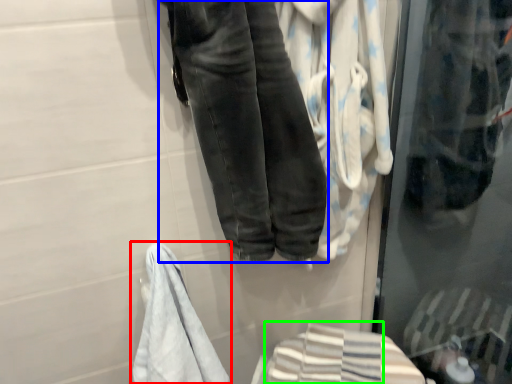
Question: Based on their relative distances, which object is nearer to towel (highlighted by a red box)? Choose from trousers (highlighted by a blue box) and bath towel (highlighted by a green box).

Choices:
 (A) trousers
 (B) bath towel

Answer: (B)